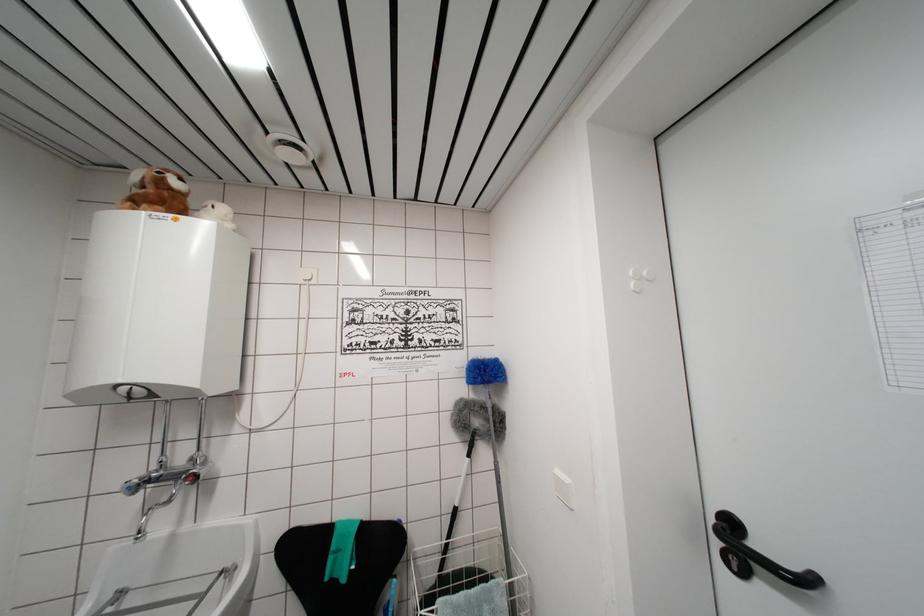
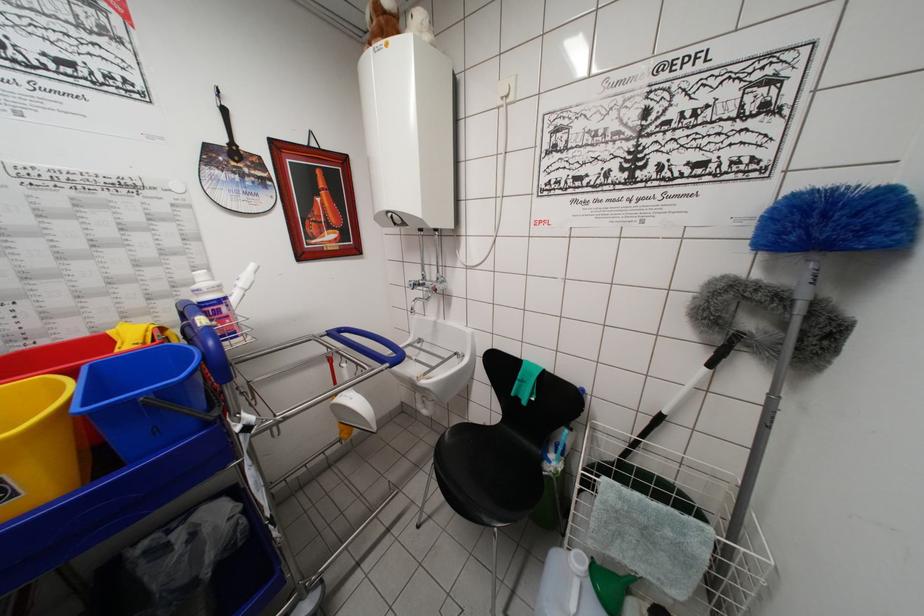
How did the camera likely rotate?

The camera rotated toward left-down.